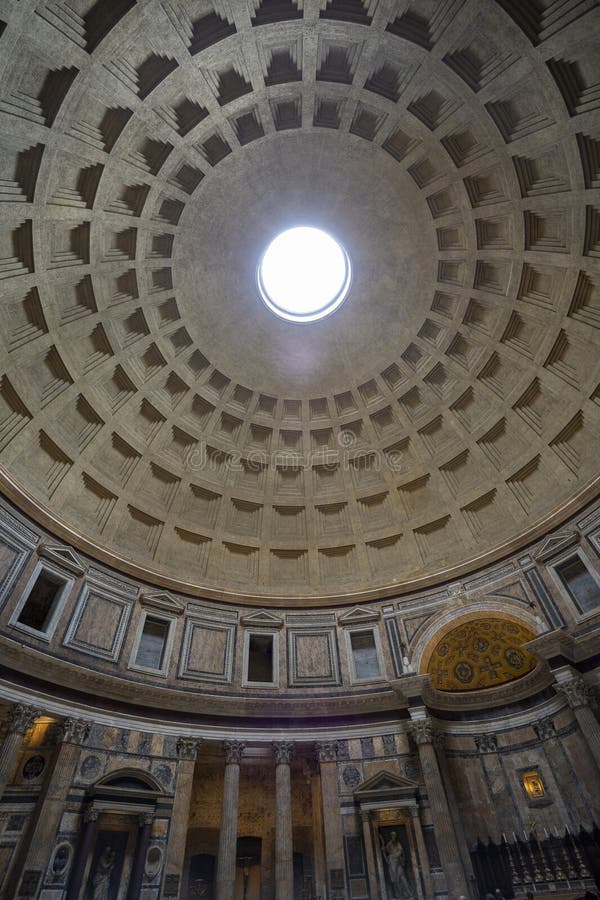
At what (x,y) coordinates should I click in order to perform the action: click on illuminated cubby. Please return your answer as a coordinate pair (x, y). This screenshot has height=900, width=600. Looking at the image, I should click on (536, 789).